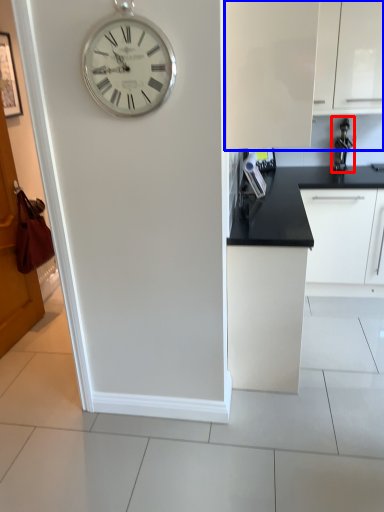
Question: Which of the following is the farthest to the observer, appliance (highlighted by a red box) or cabinetry (highlighted by a blue box)?

Choices:
 (A) appliance
 (B) cabinetry

Answer: (A)